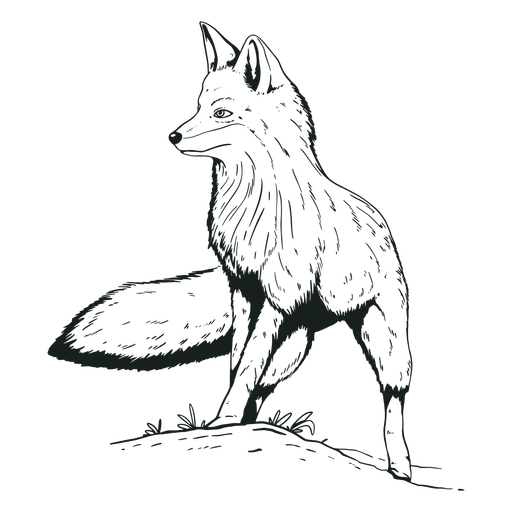
In order to click on chest in this screenshot , I will do `click(239, 212)`.